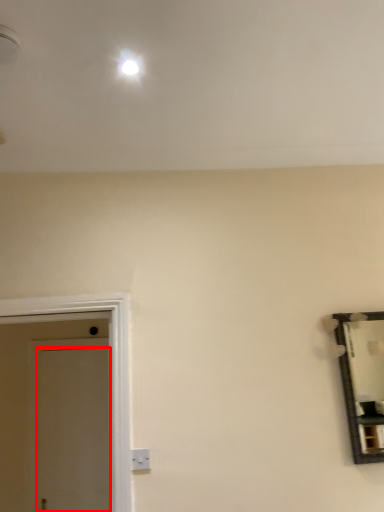
Question: From the image's perspective, considering the relative positions of door (annotated by the red box) and electric outlet in the image provided, where is door (annotated by the red box) located with respect to the staircase?

Choices:
 (A) above
 (B) below

Answer: (B)